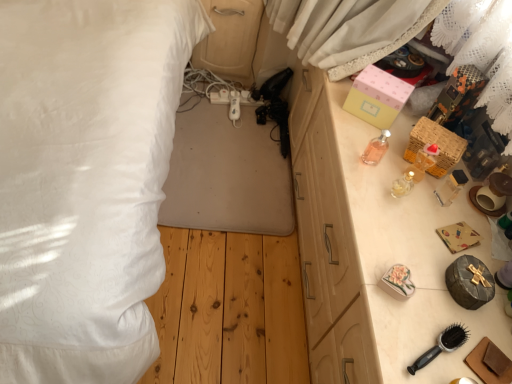
Identify the location of free point above white fabric bed at left (from a real-world perspective). This screenshot has height=384, width=512. (222, 148).